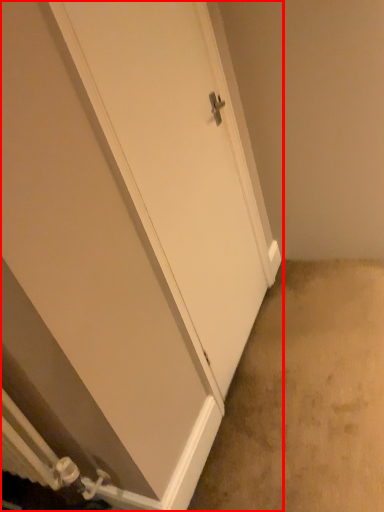
Question: From the image's perspective, where is door (annotated by the red box) located relative to concrete?

Choices:
 (A) below
 (B) above

Answer: (B)